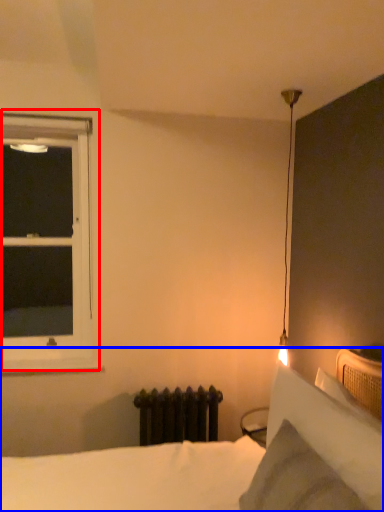
Question: Which object appears farthest to the camera in this image, window (highlighted by a red box) or bed (highlighted by a blue box)?

Choices:
 (A) window
 (B) bed

Answer: (A)